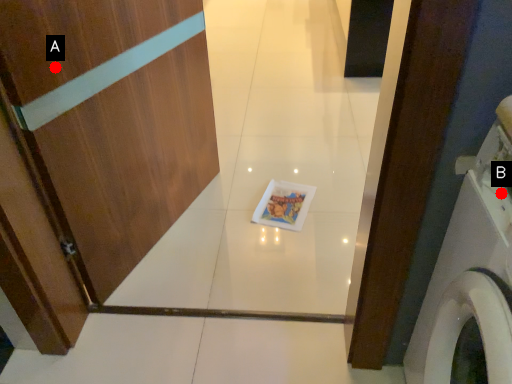
Question: Two points are circled on the image, labeled by A and B beside each circle. Which point is closer to the camera?

Choices:
 (A) A is closer
 (B) B is closer

Answer: (B)